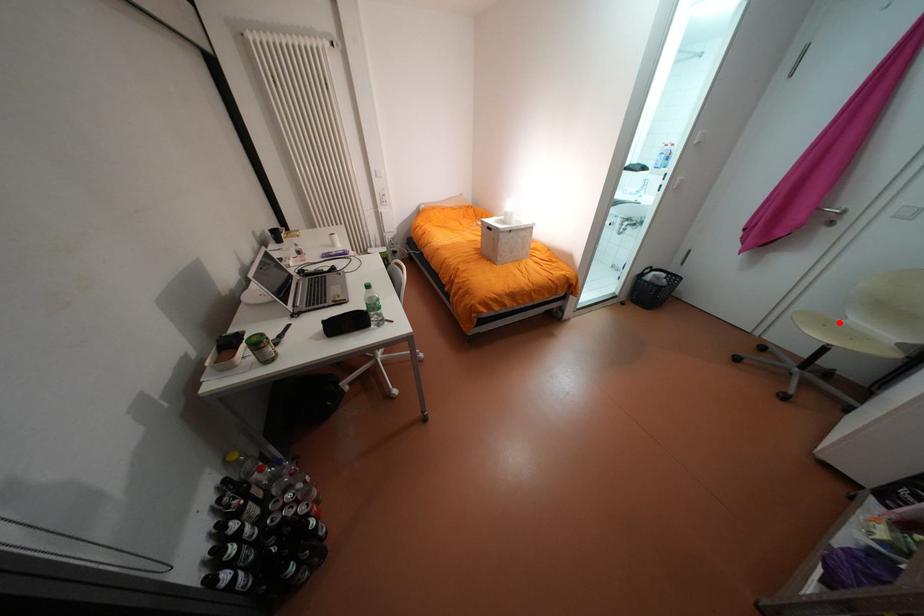
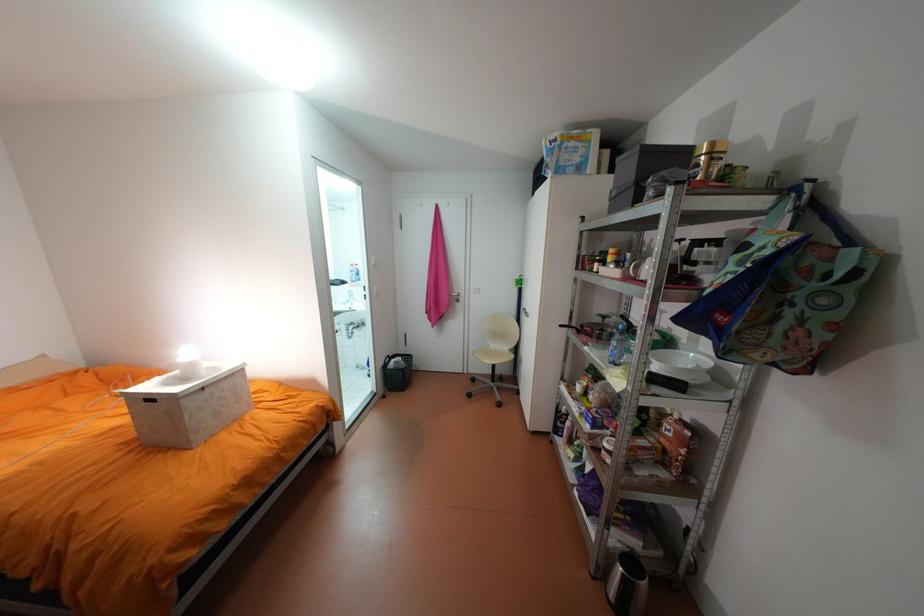
Find the pixel in the second image that matches the highlighted location in the first image.

(497, 352)